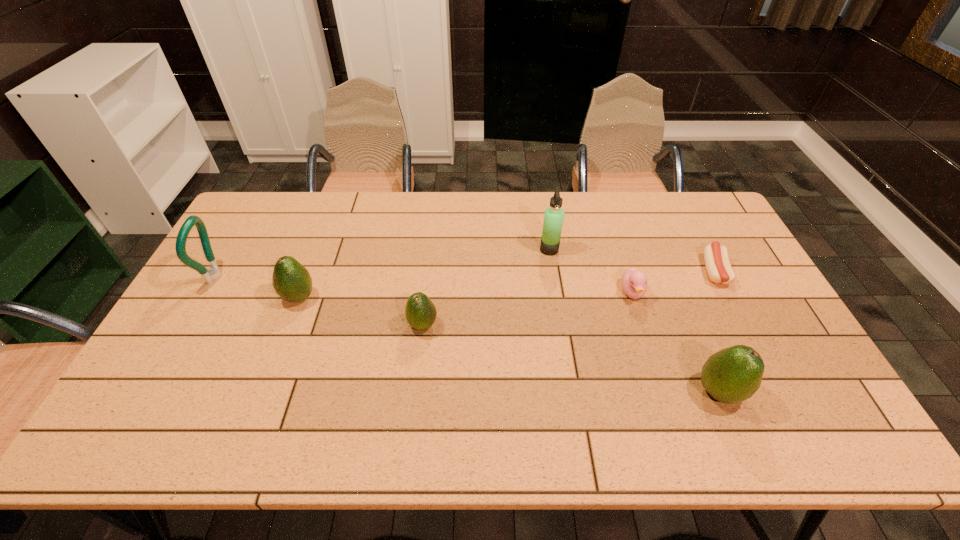
Identify the location of object present at the left edge. This screenshot has height=540, width=960. (213, 273).

Locate an element on the screen. This screenshot has height=540, width=960. object present at the right edge is located at coordinates (716, 257).

Find the location of a particular element. Image resolution: width=960 pixels, height=540 pixels. free region at the far edge of the desktop is located at coordinates (668, 227).

Locate an element on the screen. vacant space at the left edge is located at coordinates (158, 360).

In the image, there is a desktop. Identify the location of vacant space at the right edge. (756, 349).

Find the location of a particular element. The width and height of the screenshot is (960, 540). free spot at the far right corner of the desktop is located at coordinates (679, 202).

The image size is (960, 540). In order to click on free space between the shortest avocado and the second shortest object in this screenshot , I will do `click(528, 309)`.

Find the location of a particular element. vacant space that is in between the fourth tallest object and the fourth object from right to left is located at coordinates (424, 273).

Where is `unoccupied area between the rightmost avocado and the second shortest avocado`? The image size is (960, 540). unoccupied area between the rightmost avocado and the second shortest avocado is located at coordinates (509, 345).

Where is `free spot between the bottle opener and the fourth object from left to right`? This screenshot has height=540, width=960. free spot between the bottle opener and the fourth object from left to right is located at coordinates (383, 263).